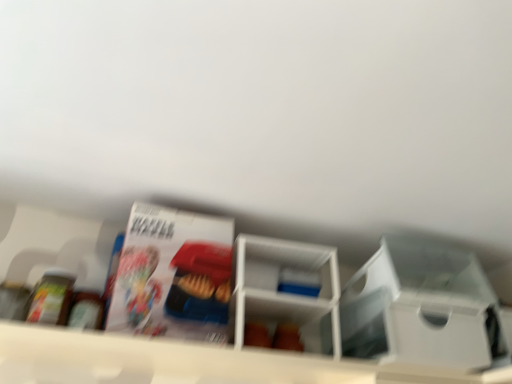
Where is `white plastic shelf at center, placed as the first shelf when sorted from left to right`? white plastic shelf at center, placed as the first shelf when sorted from left to right is located at coordinates (187, 362).

The image size is (512, 384). What do you see at coordinates (421, 307) in the screenshot?
I see `white plastic storage box at center-right` at bounding box center [421, 307].

The width and height of the screenshot is (512, 384). In order to click on white plastic storage box at center-right in this screenshot , I will do `click(421, 307)`.

Identify the location of white plastic shelf at center, placed as the first shelf when sorted from left to right. The width and height of the screenshot is (512, 384). (187, 362).

Is white plastic storage box at center-right at the back of white plastic shelf at center, positioned as the second shelf in left-to-right order?

white plastic shelf at center, positioned as the second shelf in left-to-right order, does not have its back to white plastic storage box at center-right.

In the scene shown: Is white plastic shelf at center, which is counted as the first shelf, starting from the right, bigger than white plastic storage box at center-right?

Indeed, white plastic shelf at center, which is counted as the first shelf, starting from the right, has a larger size compared to white plastic storage box at center-right.

Considering the sizes of objects white plastic shelf at center, which is counted as the first shelf, starting from the right, and white plastic storage box at center-right in the image provided, who is wider, white plastic shelf at center, which is counted as the first shelf, starting from the right, or white plastic storage box at center-right?

With larger width is white plastic storage box at center-right.

Can you confirm if white plastic shelf at center, the second shelf from the right, is thinner than white plastic storage box at center-right?

Indeed, white plastic shelf at center, the second shelf from the right, has a lesser width compared to white plastic storage box at center-right.

From the image's perspective, starting from the white plastic storage box at center-right, which shelf is the 2nd one below? Please provide its 2D coordinates.

[(187, 362)]

From a real-world perspective, is white plastic shelf at center, the second shelf from the right, physically located above or below white plastic storage box at center-right?

white plastic shelf at center, the second shelf from the right, is situated lower than white plastic storage box at center-right in the real world.

Considering the relative sizes of white plastic shelf at center, placed as the first shelf when sorted from left to right, and white plastic storage box at center-right in the image provided, is white plastic shelf at center, placed as the first shelf when sorted from left to right, shorter than white plastic storage box at center-right?

Yes.

Is white glossy magazine at upper center positioned far away from white plastic storage box at center-right?

No, white glossy magazine at upper center is not far from white plastic storage box at center-right.

From a real-world perspective, who is located higher, white glossy magazine at upper center or white plastic storage box at center-right?

white plastic storage box at center-right, from a real-world perspective.

Is white glossy magazine at upper center positioned before white plastic storage box at center-right?

That is True.

Is point (121, 279) farther from camera compared to point (366, 318)?

No.

Is white plastic storage box at center-right not near white plastic shelf at center, positioned as the second shelf in left-to-right order?

No, white plastic storage box at center-right is not far away from white plastic shelf at center, positioned as the second shelf in left-to-right order.

The image size is (512, 384). I want to click on storage box on the right of white plastic shelf at center, which is counted as the first shelf, starting from the right, so click(421, 307).

Would you say white plastic storage box at center-right is outside white plastic shelf at center, positioned as the second shelf in left-to-right order?

Yes, white plastic storage box at center-right is outside of white plastic shelf at center, positioned as the second shelf in left-to-right order.

Between white plastic shelf at center, placed as the first shelf when sorted from left to right, and white plastic shelf at center, positioned as the second shelf in left-to-right order, which one has less height?

white plastic shelf at center, placed as the first shelf when sorted from left to right, is shorter.

Are white plastic shelf at center, the second shelf from the right, and white plastic shelf at center, positioned as the second shelf in left-to-right order, located far from each other?

They are positioned close to each other.

Where is `shelf lying below the white plastic shelf at center, positioned as the second shelf in left-to-right order (from the image's perspective)`? shelf lying below the white plastic shelf at center, positioned as the second shelf in left-to-right order (from the image's perspective) is located at coordinates (187, 362).

How far apart are white plastic shelf at center, the second shelf from the right, and white plastic shelf at center, which is counted as the first shelf, starting from the right?

The distance of white plastic shelf at center, the second shelf from the right, from white plastic shelf at center, which is counted as the first shelf, starting from the right, is 10.21 inches.

Do you think white plastic storage box at center-right is within white plastic shelf at center, the second shelf from the right, or outside of it?

white plastic storage box at center-right is located beyond the bounds of white plastic shelf at center, the second shelf from the right.

Which object is wider, white plastic storage box at center-right or white plastic shelf at center, the second shelf from the right?

Wider between the two is white plastic storage box at center-right.

How many degrees apart are the facing directions of white plastic storage box at center-right and white plastic shelf at center, the second shelf from the right?

The facing directions of white plastic storage box at center-right and white plastic shelf at center, the second shelf from the right, are 0.953 degrees apart.

Who is bigger, white plastic storage box at center-right or white plastic shelf at center, the second shelf from the right?

Bigger between the two is white plastic storage box at center-right.

Could you tell me if white plastic shelf at center, which is counted as the first shelf, starting from the right, is turned towards white glossy magazine at upper center?

No, white plastic shelf at center, which is counted as the first shelf, starting from the right, is not aimed at white glossy magazine at upper center.

Considering their positions, is white plastic shelf at center, positioned as the second shelf in left-to-right order, located in front of or behind white glossy magazine at upper center?

white plastic shelf at center, positioned as the second shelf in left-to-right order, is behind white glossy magazine at upper center.

Is white plastic shelf at center, positioned as the second shelf in left-to-right order, beside white glossy magazine at upper center?

white plastic shelf at center, positioned as the second shelf in left-to-right order, and white glossy magazine at upper center are not in contact.

How distant is white plastic shelf at center, positioned as the second shelf in left-to-right order, from white glossy magazine at upper center?

A distance of 7.66 inches exists between white plastic shelf at center, positioned as the second shelf in left-to-right order, and white glossy magazine at upper center.

The width and height of the screenshot is (512, 384). Find the location of `the 1st shelf in front when counting from the white plastic storage box at center-right`. the 1st shelf in front when counting from the white plastic storage box at center-right is located at coordinates (284, 292).

What are the coordinates of `storage box lying above the white plastic shelf at center, placed as the first shelf when sorted from left to right (from the image's perspective)` in the screenshot? It's located at (421, 307).

Considering their positions, is white plastic shelf at center, placed as the first shelf when sorted from left to right, positioned further to white plastic shelf at center, positioned as the second shelf in left-to-right order, than white plastic storage box at center-right?

white plastic storage box at center-right lies further to white plastic shelf at center, positioned as the second shelf in left-to-right order, than the other object.

Based on their spatial positions, is white plastic shelf at center, the second shelf from the right, or white plastic shelf at center, which is counted as the first shelf, starting from the right, closer to white plastic storage box at center-right?

The object closer to white plastic storage box at center-right is white plastic shelf at center, which is counted as the first shelf, starting from the right.

Considering their positions, is white glossy magazine at upper center positioned further to white plastic shelf at center, the second shelf from the right, than white plastic storage box at center-right?

Among the two, white plastic storage box at center-right is located further to white plastic shelf at center, the second shelf from the right.

Which object lies nearer to the anchor point white plastic shelf at center, which is counted as the first shelf, starting from the right, white glossy magazine at upper center or white plastic shelf at center, placed as the first shelf when sorted from left to right?

Among the two, white glossy magazine at upper center is located nearer to white plastic shelf at center, which is counted as the first shelf, starting from the right.

Estimate the real-world distances between objects in this image. Which object is further from white plastic storage box at center-right, white plastic shelf at center, which is counted as the first shelf, starting from the right, or white glossy magazine at upper center?

white glossy magazine at upper center is positioned further to the anchor white plastic storage box at center-right.

Which object lies nearer to the anchor point white glossy magazine at upper center, white plastic storage box at center-right or white plastic shelf at center, positioned as the second shelf in left-to-right order?

white plastic shelf at center, positioned as the second shelf in left-to-right order.

Considering their positions, is white glossy magazine at upper center positioned further to white plastic storage box at center-right than white plastic shelf at center, placed as the first shelf when sorted from left to right?

Based on the image, white glossy magazine at upper center appears to be further to white plastic storage box at center-right.

From the picture: Estimate the real-world distances between objects in this image. Which object is further from white plastic shelf at center, positioned as the second shelf in left-to-right order, white plastic shelf at center, placed as the first shelf when sorted from left to right, or white glossy magazine at upper center?

white plastic shelf at center, placed as the first shelf when sorted from left to right, is positioned further to the anchor white plastic shelf at center, positioned as the second shelf in left-to-right order.

Locate an element on the screen. Image resolution: width=512 pixels, height=384 pixels. shelf situated between white glossy magazine at upper center and white plastic shelf at center, which is counted as the first shelf, starting from the right, from left to right is located at coordinates (187, 362).

Where is `shelf between white plastic shelf at center, placed as the first shelf when sorted from left to right, and white plastic storage box at center-right`? The height and width of the screenshot is (384, 512). shelf between white plastic shelf at center, placed as the first shelf when sorted from left to right, and white plastic storage box at center-right is located at coordinates (284, 292).